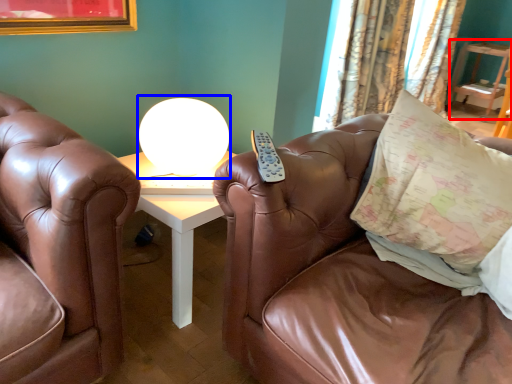
Question: Which point is further to the camera, table (highlighted by a red box) or table lamp (highlighted by a blue box)?

Choices:
 (A) table
 (B) table lamp

Answer: (A)